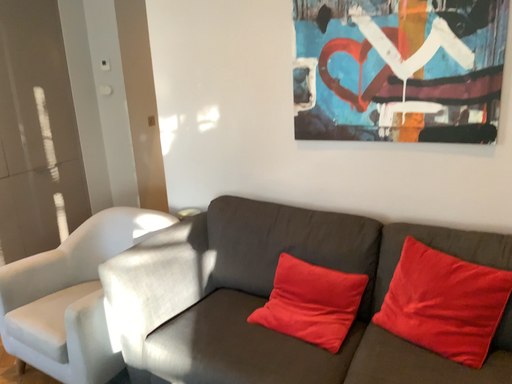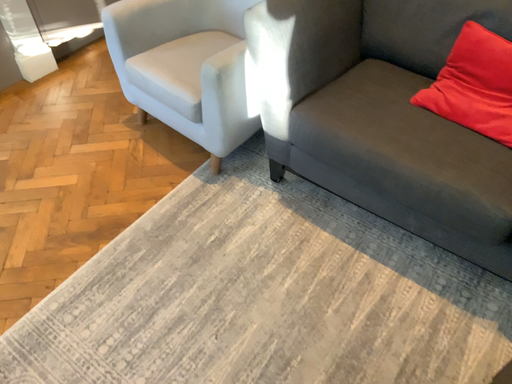
Question: How did the camera likely rotate when shooting the video?

Choices:
 (A) rotated left
 (B) rotated right

Answer: (A)